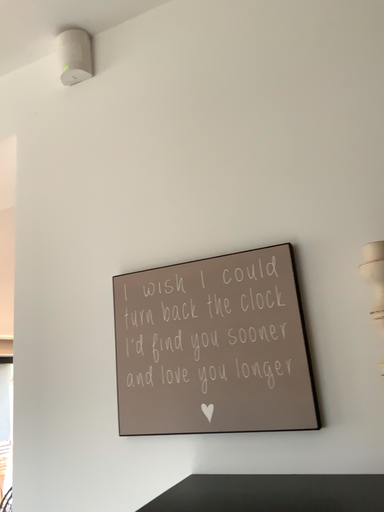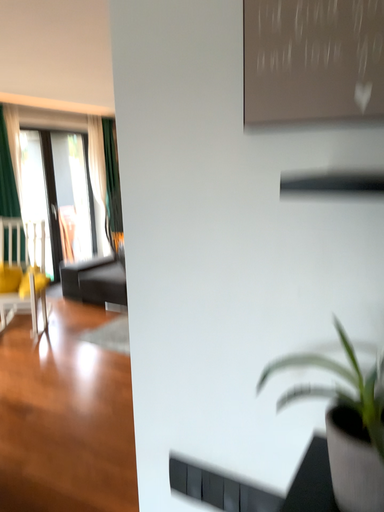
Question: How did the camera likely rotate when shooting the video?

Choices:
 (A) rotated downward
 (B) rotated upward

Answer: (A)